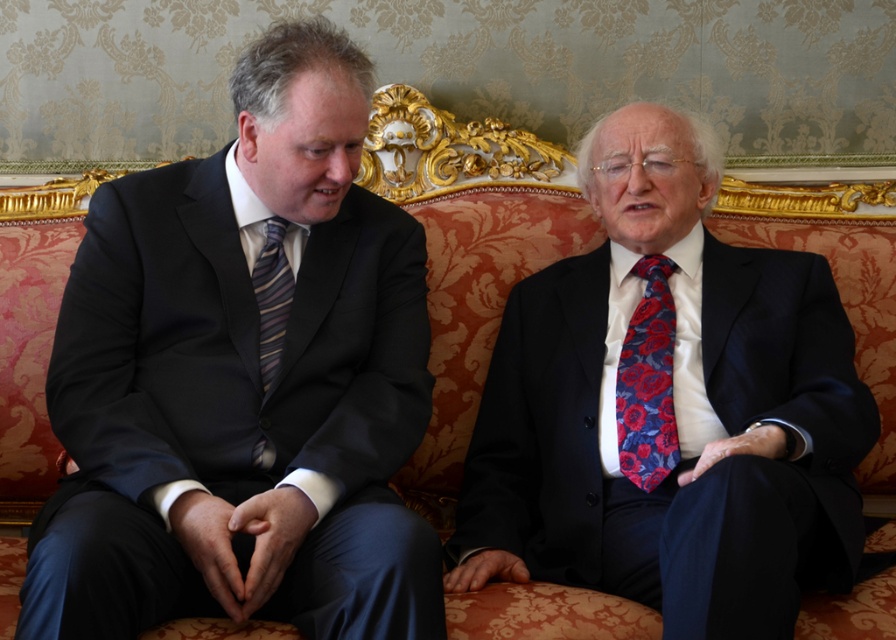
Can you confirm if matte black suit at center is thinner than striped silk tie at left?

No, matte black suit at center is not thinner than striped silk tie at left.

Is matte black suit at center bigger than striped silk tie at left?

Yes.

Between point (739, 348) and point (263, 321), which one is positioned behind?

Point (739, 348)

The height and width of the screenshot is (640, 896). Find the location of `matte black suit at center`. matte black suit at center is located at coordinates (668, 408).

Consider the image. Measure the distance between point (x=121, y=330) and camera.

Point (x=121, y=330) and camera are 1.81 meters apart from each other.

Is point (254, 548) farther from camera compared to point (608, 125)?

No, it is in front of (608, 125).

Does point (263, 401) come farther from viewer compared to point (729, 516)?

Yes, point (263, 401) is behind point (729, 516).

I want to click on matte black suit at left, so click(242, 381).

Is matte black suit at left below red floral silk tie at right?

No, matte black suit at left is not below red floral silk tie at right.

How far apart are matte black suit at left and red floral silk tie at right?

matte black suit at left is 31.77 inches from red floral silk tie at right.

Does point (194, 556) lie behind point (642, 372)?

That is False.

What are the coordinates of `matte black suit at left` in the screenshot? It's located at (242, 381).